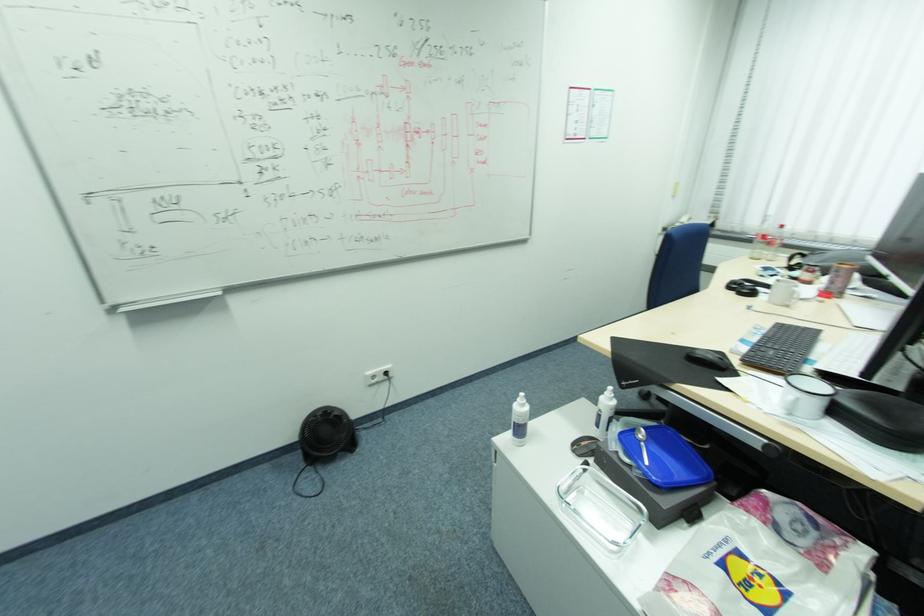
Which object does [518,419] point to?

It refers to a clear plastic bottle.